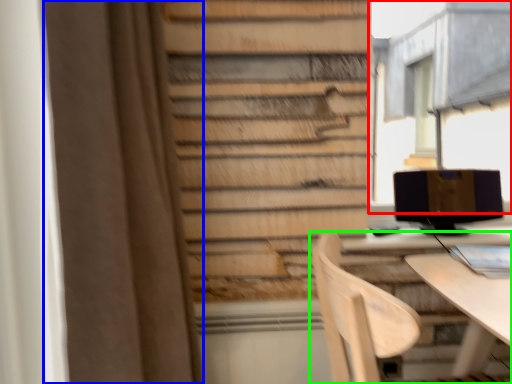
Question: Which object is the closest to the bay window (highlighted by a red box)? Choose among these: curtain (highlighted by a blue box) or chair (highlighted by a green box).

Choices:
 (A) curtain
 (B) chair

Answer: (A)